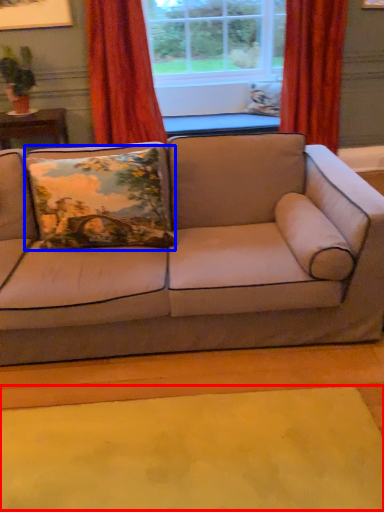
Question: Which object is further to the camera taking this photo, mat (highlighted by a red box) or pillow (highlighted by a blue box)?

Choices:
 (A) mat
 (B) pillow

Answer: (B)